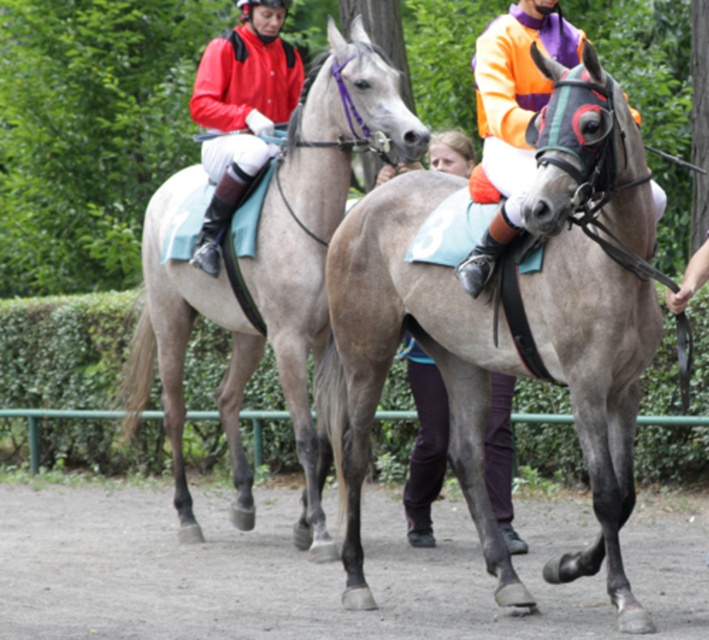
Does gray matte horse at center come in front of orange jersey at center?

Yes, gray matte horse at center is closer to the viewer.

Based on the photo, does gray matte horse at center appear on the right side of orange jersey at center?

Incorrect, gray matte horse at center is not on the right side of orange jersey at center.

Is point (352, 227) more distant than point (508, 173)?

Yes, it is.

This screenshot has height=640, width=709. Find the location of `gray matte horse at center`. gray matte horse at center is located at coordinates (596, 314).

Is green leafy hedge at center to the right of orange jersey at center from the viewer's perspective?

No, green leafy hedge at center is not to the right of orange jersey at center.

This screenshot has height=640, width=709. In order to click on green leafy hedge at center in this screenshot , I will do `click(65, 348)`.

The height and width of the screenshot is (640, 709). What do you see at coordinates (65, 348) in the screenshot?
I see `green leafy hedge at center` at bounding box center [65, 348].

Identify the location of green leafy hedge at center. (65, 348).

This screenshot has width=709, height=640. What do you see at coordinates (318, 232) in the screenshot?
I see `gray matte/suede horse at left` at bounding box center [318, 232].

Does gray matte/suede horse at left have a greater height compared to orange jersey at center?

Yes, gray matte/suede horse at left is taller than orange jersey at center.

Describe the element at coordinates (318, 232) in the screenshot. I see `gray matte/suede horse at left` at that location.

The width and height of the screenshot is (709, 640). What are the coordinates of `gray matte/suede horse at left` in the screenshot? It's located at (318, 232).